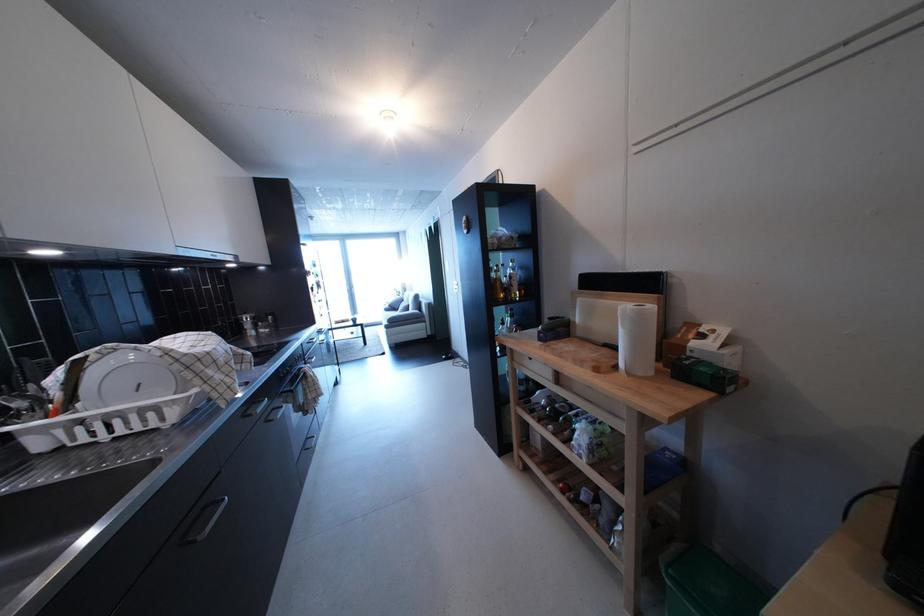
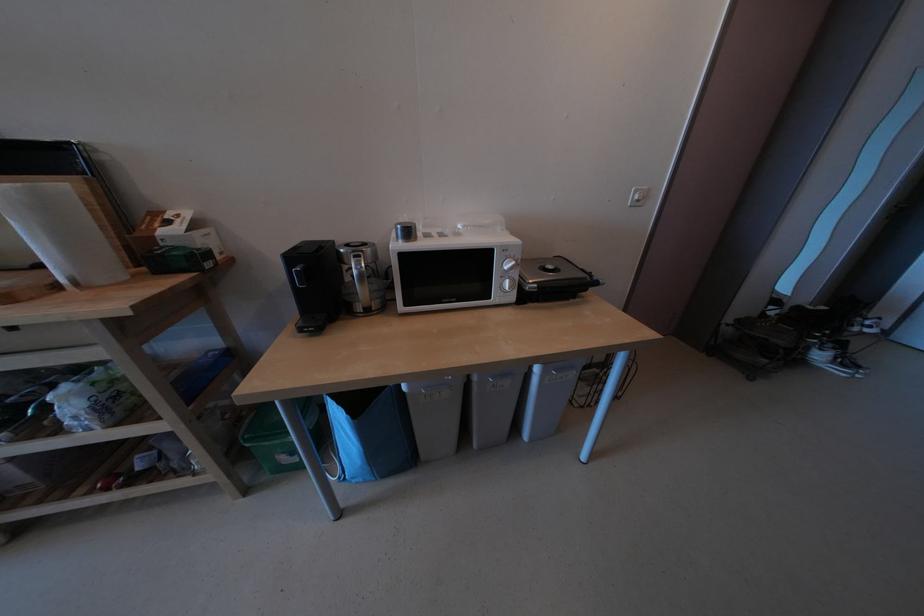
First-person continuous shooting, in which direction is the camera rotating?

The camera's rotation is toward right-down.